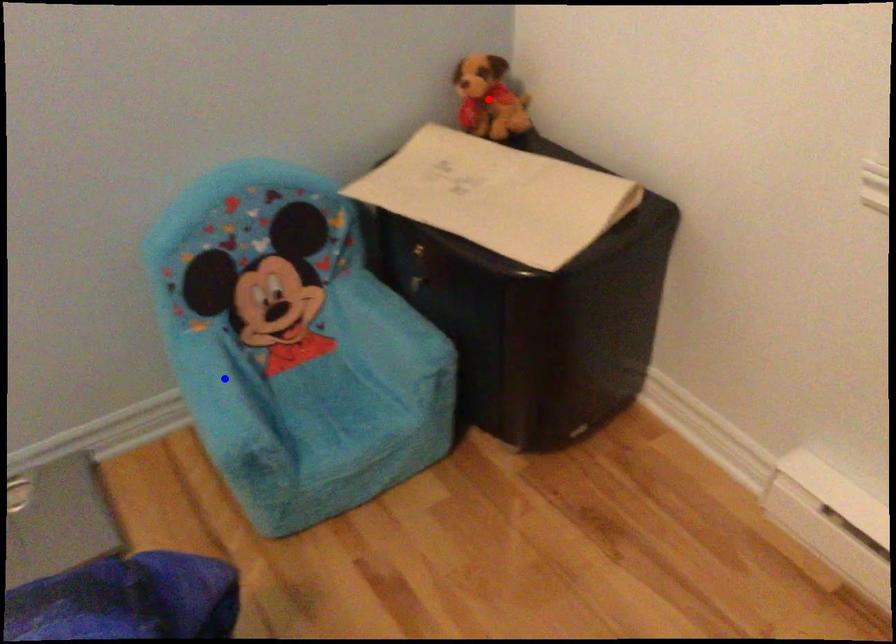
Question: In the image, two points are highlighted. Which point is nearer to the camera? Reply with the corresponding letter.

Choices:
 (A) blue point
 (B) red point

Answer: (A)